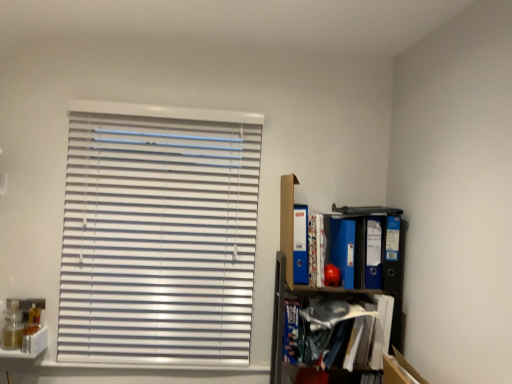
Question: Is blue glossy folder at right, the 4th paperback book from the left, smaller than blue matte book at lower right, placed as the second book when sorted from right to left?

Choices:
 (A) no
 (B) yes

Answer: (A)

Question: Is blue glossy folder at right, the 1th paperback book from the right, looking in the opposite direction of blue matte book at lower right, which appears as the 1th book when ordered from the bottom?

Choices:
 (A) no
 (B) yes

Answer: (A)

Question: Considering the relative sizes of blue glossy folder at right, the 1th paperback book from the right, and blue matte book at lower right, which ranks as the 2th book in top-to-bottom order, in the image provided, is blue glossy folder at right, the 1th paperback book from the right, wider than blue matte book at lower right, which ranks as the 2th book in top-to-bottom order,?

Choices:
 (A) no
 (B) yes

Answer: (A)

Question: Considering the relative positions of blue glossy folder at right, the 4th paperback book from the left, and blue matte book at lower right, which appears as the 1th book when ordered from the bottom, in the image provided, is blue glossy folder at right, the 4th paperback book from the left, to the left of blue matte book at lower right, which appears as the 1th book when ordered from the bottom, from the viewer's perspective?

Choices:
 (A) no
 (B) yes

Answer: (A)

Question: Is blue glossy folder at right, the 1th paperback book from the right, positioned before blue matte book at lower right, which appears as the 1th book when ordered from the bottom?

Choices:
 (A) no
 (B) yes

Answer: (A)

Question: From a real-world perspective, is blue glossy folder at right, the 1th paperback book from the right, on top of blue matte book at lower right, which appears as the 1th book when ordered from the bottom?

Choices:
 (A) no
 (B) yes

Answer: (B)

Question: Is blue glossy folder at right, the 4th paperback book from the left, completely or partially inside patterned paper book at upper right, the 1th book from the right?

Choices:
 (A) no
 (B) yes

Answer: (A)

Question: From the image's perspective, is patterned paper book at upper right, the 1th book from the right, below blue glossy folder at right, the 1th paperback book from the right?

Choices:
 (A) no
 (B) yes

Answer: (A)

Question: From the image's perspective, does patterned paper book at upper right, the second book when ordered from bottom to top, appear higher than blue glossy folder at right, the 1th paperback book from the right?

Choices:
 (A) yes
 (B) no

Answer: (A)

Question: Can you confirm if patterned paper book at upper right, which is the first book in top-to-bottom order, is shorter than blue glossy folder at right, the 4th paperback book from the left?

Choices:
 (A) yes
 (B) no

Answer: (A)

Question: Is patterned paper book at upper right, which is the first book in top-to-bottom order, to the left of blue glossy folder at right, the 1th paperback book from the right, from the viewer's perspective?

Choices:
 (A) no
 (B) yes

Answer: (B)

Question: From a real-world perspective, is patterned paper book at upper right, the 1th book from the right, physically above blue glossy folder at right, the 4th paperback book from the left?

Choices:
 (A) no
 (B) yes

Answer: (A)

Question: Does blue matte book at lower right, placed as the second book when sorted from right to left, have a lesser width compared to blue matte folder at upper right, which is the 4th paperback book in right-to-left order?

Choices:
 (A) yes
 (B) no

Answer: (B)